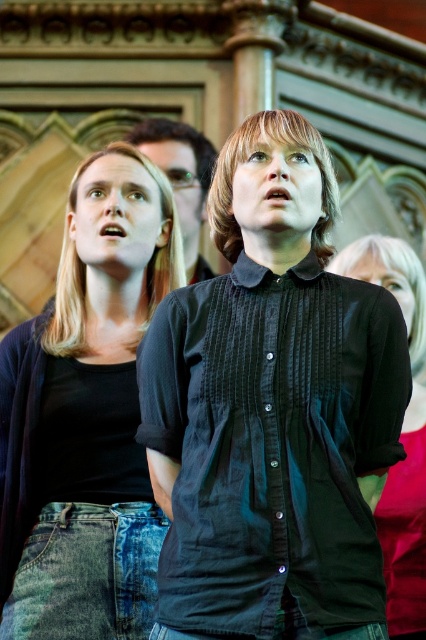
In the scene shown: You are a photographer setting up a shoot in this scene. You need to ensure that the black cotton shirt at center and the denim jeans at left are both visible in the frame. Given their sizes, which object should you prioritize positioning closer to the camera to maintain clarity?

The black cotton shirt at center is smaller than the denim jeans at left, so you should prioritize positioning the black cotton shirt at center closer to the camera to ensure it remains visible and clear in the photograph.